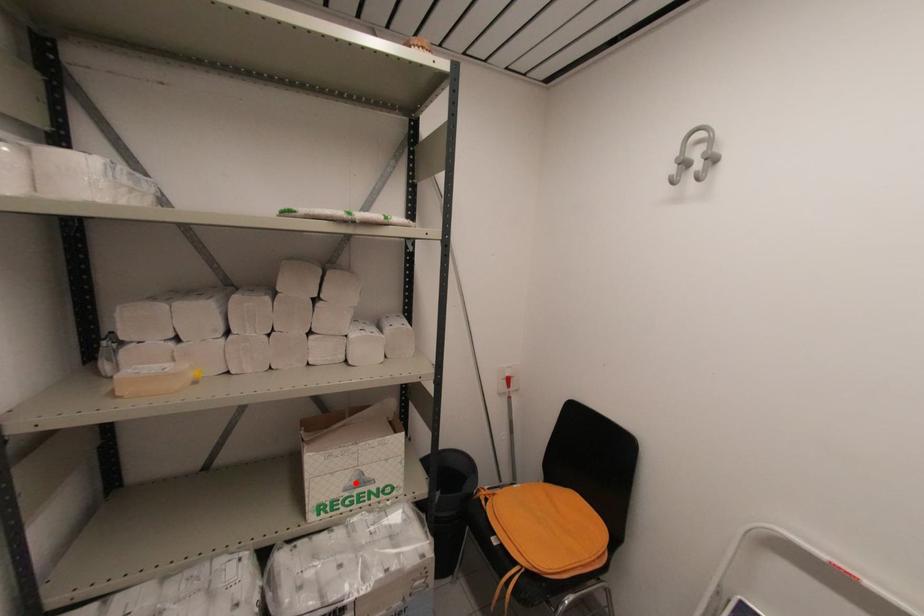
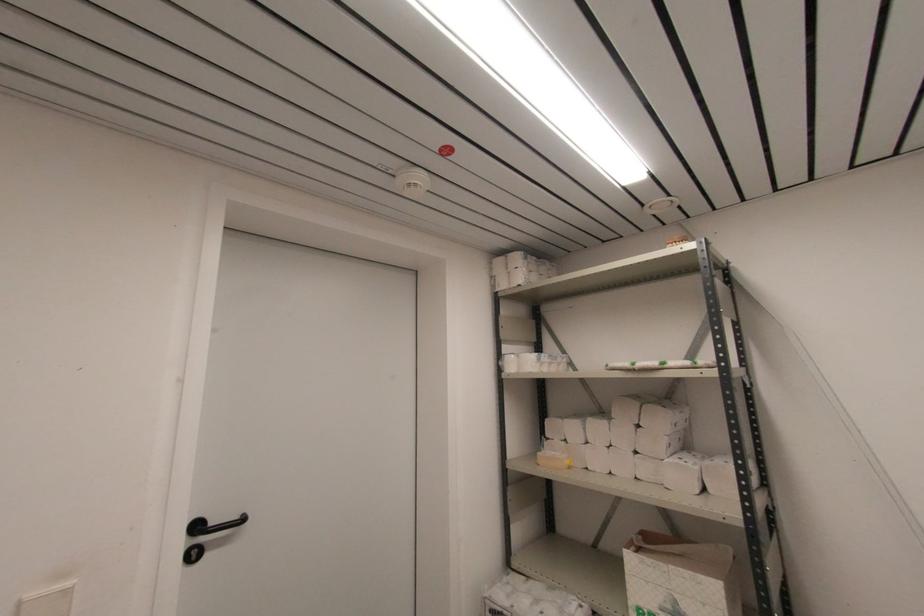
Question: I am providing you with two images of the same scene from different viewpoints. A red point is shown in image1. For the corresponding object point in image2, is it positioned nearer or farther from the camera?

Choices:
 (A) Nearer
 (B) Farther

Answer: (A)